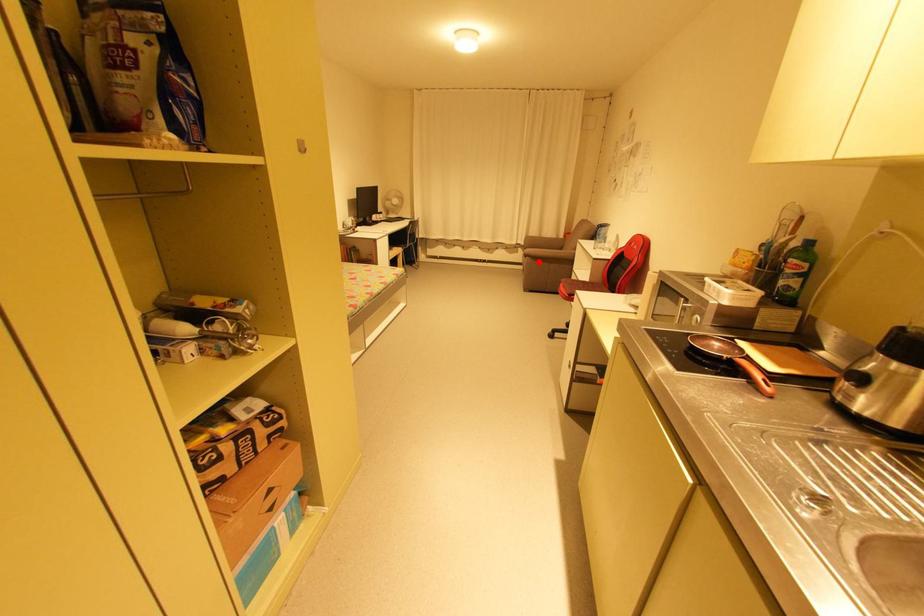
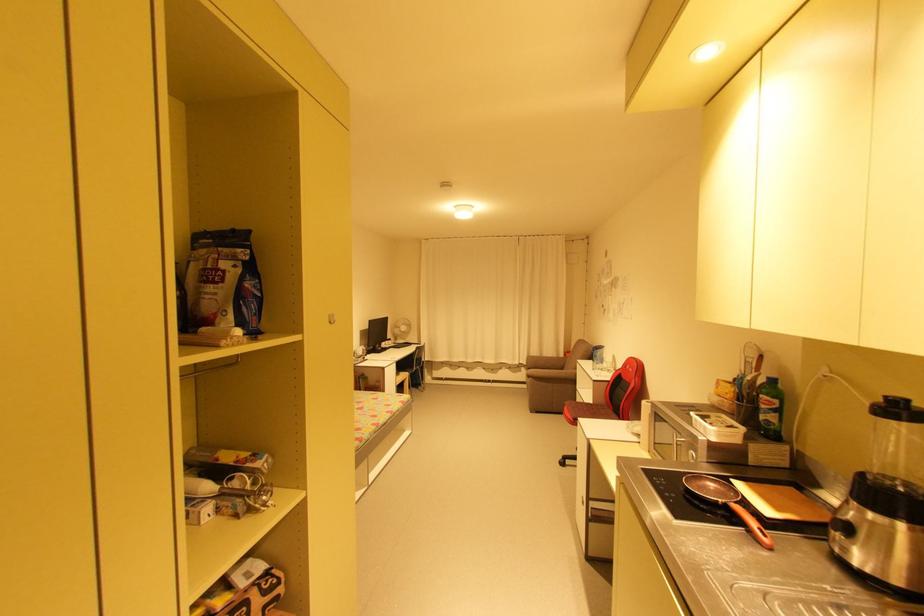
The point at the highlighted location is marked in the first image. Where is the corresponding point in the second image?

(542, 383)